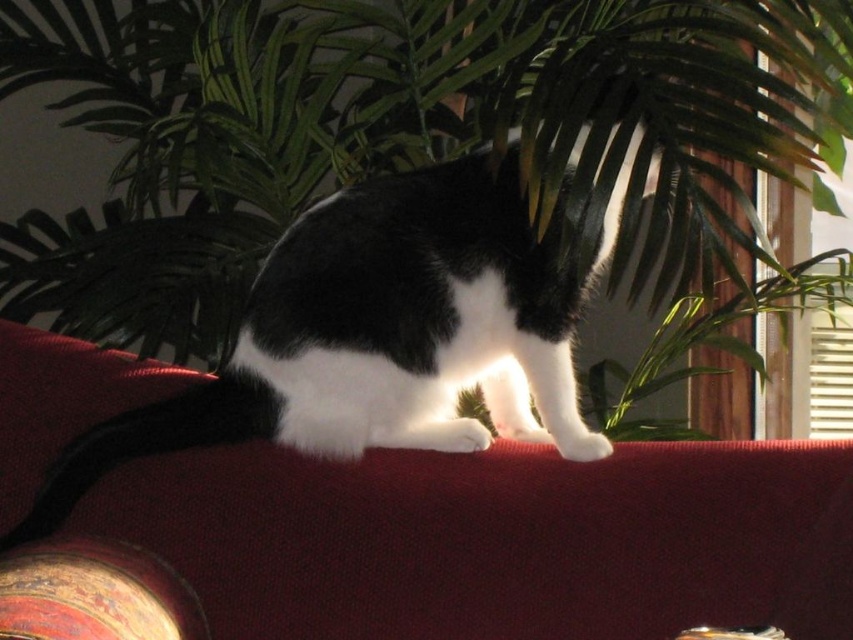
You are standing in the room and want to place a small decorative item on the green leafy plant at upper center. The coordinates of the plant are given as point (407, 138). If you have a 3D map of the room, can you confirm if this point is indeed on the green leafy plant at upper center?

Yes, according to the coordinates provided, point (407, 138) is on the green leafy plant at upper center.

You are a photographer setting up a shoot in this room. You want to position a light source so that it illuminates the green leafy plant at upper center without casting a shadow on the burgundy fabric couch at upper center. Based on their positions, is this possible?

The green leafy plant at upper center is located above the burgundy fabric couch at upper center. Since the plant is above the couch, placing the light source below the plant would cast its shadow downward, potentially onto the couch. However, if the light is placed above the plant, the shadow would fall away from the couch, so positioning the light source above the green leafy plant at upper center would allow illumination without casting a shadow on the burgundy fabric couch at upper center.